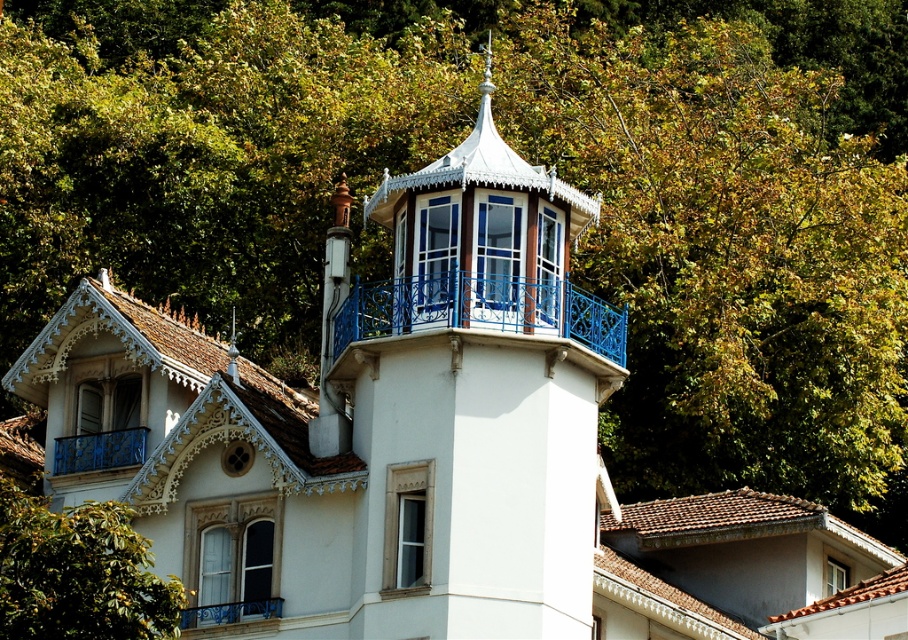
Question: Can you confirm if green leafy tree at center is positioned above blue wrought iron balcony at center?

Choices:
 (A) yes
 (B) no

Answer: (B)

Question: Which of the following is the closest to the observer?

Choices:
 (A) blue painted metal balcony at lower center
 (B) blue wrought iron balcony at center
 (C) blue painted metal railing at lower left
 (D) white painted wood bell tower at center

Answer: (D)

Question: Does white painted wood bell tower at center come behind green leafy tree at center?

Choices:
 (A) no
 (B) yes

Answer: (B)

Question: Among these points, which one is farthest from the camera?

Choices:
 (A) (397, 579)
 (B) (568, 307)

Answer: (B)

Question: Is white painted wood bell tower at center closer to camera compared to blue painted metal balcony at lower center?

Choices:
 (A) no
 (B) yes

Answer: (B)

Question: Which point is farther to the camera?

Choices:
 (A) blue painted metal balcony at lower center
 (B) blue painted metal railing at lower left

Answer: (B)